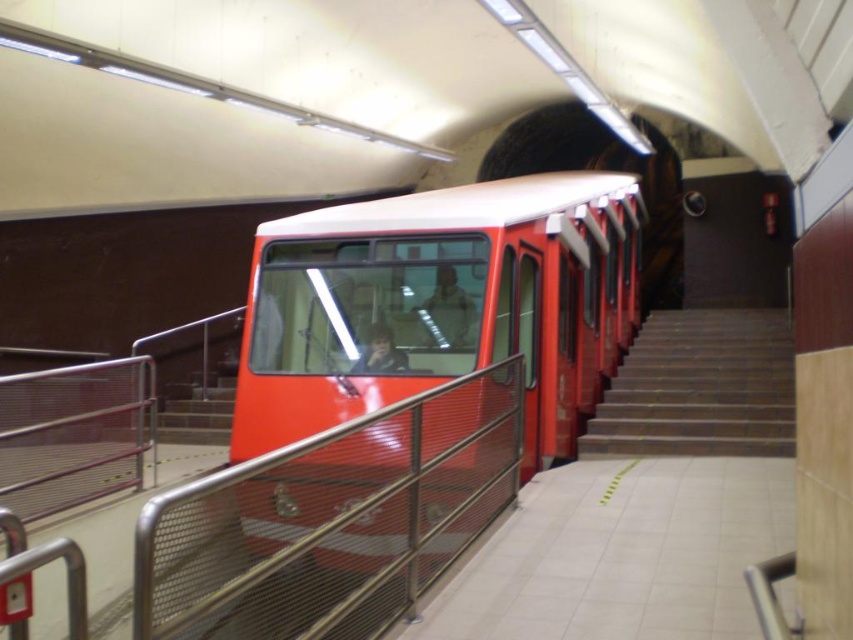
Question: Among these objects, which one is nearest to the camera?

Choices:
 (A) smooth concrete stairs at right
 (B) metal mesh railing at center

Answer: (B)

Question: Does matte red train at center appear under smooth concrete stairs at right?

Choices:
 (A) no
 (B) yes

Answer: (A)

Question: Estimate the real-world distances between objects in this image. Which object is farther from the matte red train at center?

Choices:
 (A) smooth concrete stairs at right
 (B) metal mesh railing at center

Answer: (A)

Question: From the image, what is the correct spatial relationship of metal mesh railing at center in relation to smooth concrete stairs at right?

Choices:
 (A) left
 (B) right

Answer: (A)

Question: Is metal mesh railing at center closer to camera compared to smooth concrete stairs at right?

Choices:
 (A) yes
 (B) no

Answer: (A)

Question: Which point appears closest to the camera in this image?

Choices:
 (A) (431, 349)
 (B) (300, 525)

Answer: (B)